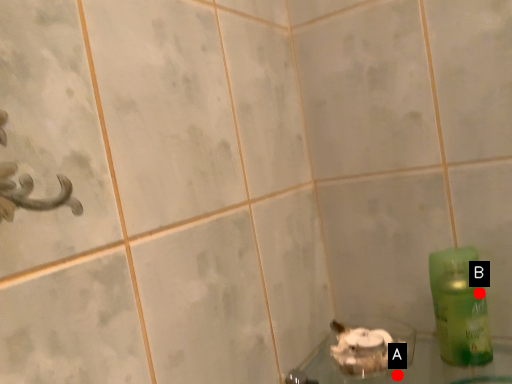
Question: Two points are circled on the image, labeled by A and B beside each circle. Which point is closer to the camera taking this photo?

Choices:
 (A) A is closer
 (B) B is closer

Answer: (B)